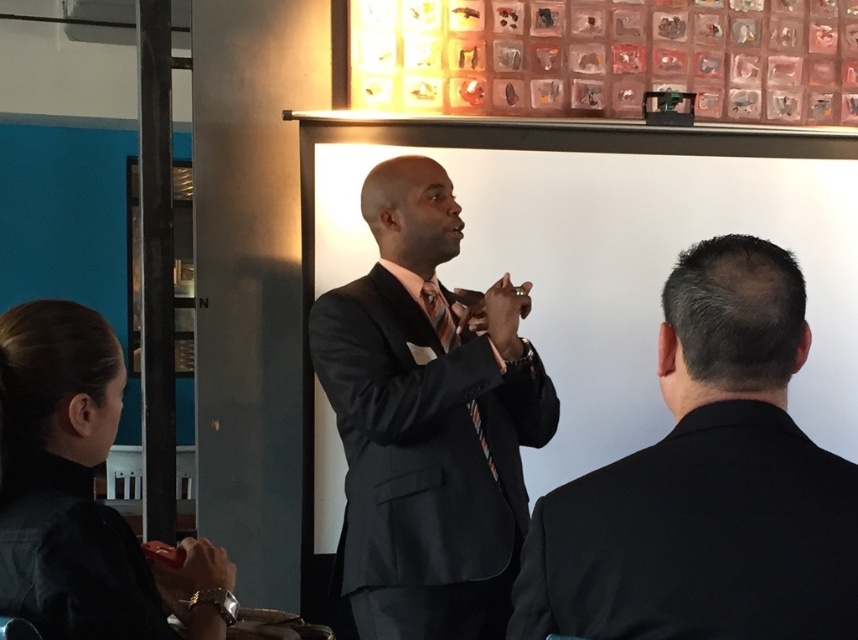
Question: Can you confirm if matte black suit at center is positioned to the right of striped silk tie at center?

Choices:
 (A) yes
 (B) no

Answer: (B)

Question: In this image, where is matte black suit at center located relative to black fabric shirt at lower left?

Choices:
 (A) left
 (B) right

Answer: (B)

Question: Among these points, which one is farthest from the camera?

Choices:
 (A) (x=418, y=304)
 (B) (x=55, y=365)

Answer: (A)

Question: Based on their relative distances, which object is farther from the matte black suit at center?

Choices:
 (A) black suit at center
 (B) black fabric shirt at lower left
 (C) striped silk tie at center

Answer: (A)

Question: Which point appears farthest from the camera in this image?

Choices:
 (A) (358, 534)
 (B) (762, 275)
 (C) (178, 570)

Answer: (A)

Question: Can you confirm if matte black suit at center is bigger than striped silk tie at center?

Choices:
 (A) no
 (B) yes

Answer: (B)